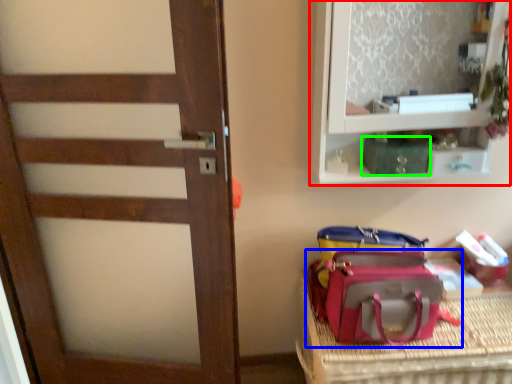
Question: Which object is positioned closest to shelf (highlighted by a red box)? Select from luggage and bags (highlighted by a blue box) and kit (highlighted by a green box).

Choices:
 (A) luggage and bags
 (B) kit

Answer: (B)